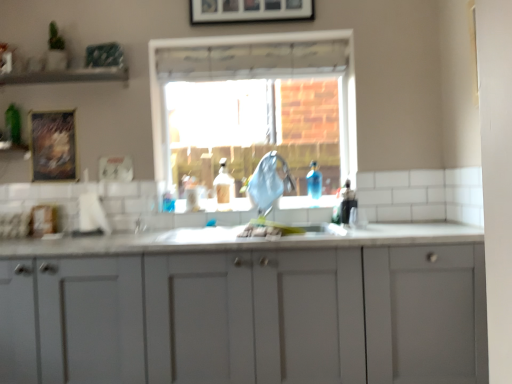
Where is `wooden framed picture at upper center, acting as the 2th picture frame starting from the back`? wooden framed picture at upper center, acting as the 2th picture frame starting from the back is located at coordinates (249, 11).

What is the approximate width of blue fabric at center?

It is 21.92 centimeters.

What are the coordinates of `translucent plastic bottle at center` in the screenshot? It's located at (224, 185).

Find the location of a particular element. This screenshot has width=512, height=384. wooden framed picture at upper center, acting as the 2th picture frame starting from the back is located at coordinates (249, 11).

Which point is more forward, (265, 176) or (51, 112)?

The point (265, 176) is closer to the camera.

Considering the sizes of objects blue fabric at center and wooden textured frame at upper left, which is the second picture frame from right to left, in the image provided, who is taller, blue fabric at center or wooden textured frame at upper left, which is the second picture frame from right to left,?

wooden textured frame at upper left, which is the second picture frame from right to left, is taller.

Is blue fabric at center beside wooden textured frame at upper left, the 2th picture frame when ordered from top to bottom?

No, blue fabric at center is not touching wooden textured frame at upper left, the 2th picture frame when ordered from top to bottom.

Is translucent plastic bottle at center inside or outside of blue fabric at center?

translucent plastic bottle at center is located beyond the bounds of blue fabric at center.

From the image's perspective, would you say translucent plastic bottle at center is positioned over blue fabric at center?

No.

Is translucent plastic bottle at center looking in the opposite direction of blue fabric at center?

No.

Considering the relative positions of translucent plastic bottle at center and blue fabric at center in the image provided, is translucent plastic bottle at center in front of blue fabric at center?

No.

In the scene shown: Would you say clear glass window at center contains translucent plastic bottle at center?

No, translucent plastic bottle at center is not surrounded by clear glass window at center.

Which is behind, clear glass window at center or translucent plastic bottle at center?

Positioned behind is clear glass window at center.

Is clear glass window at center facing towards translucent plastic bottle at center?

Yes, clear glass window at center is oriented towards translucent plastic bottle at center.

Do you think clear glass window at center is within blue fabric at center, or outside of it?

clear glass window at center lies outside blue fabric at center.

From a real-world perspective, between clear glass window at center and blue fabric at center, who is vertically lower?

blue fabric at center, from a real-world perspective.

Based on the photo, from the image's perspective, is clear glass window at center above or below blue fabric at center?

Based on their image positions, clear glass window at center is located above blue fabric at center.

Which is behind, point (50, 168) or point (284, 19)?

Point (50, 168)

Is wooden textured frame at upper left, placed as the first picture frame when sorted from bottom to top, inside the boundaries of wooden framed picture at upper center, acting as the 2th picture frame starting from the back, or outside?

wooden textured frame at upper left, placed as the first picture frame when sorted from bottom to top, is spatially situated outside wooden framed picture at upper center, acting as the 2th picture frame starting from the back.

Is wooden textured frame at upper left, placed as the first picture frame when sorted from bottom to top, further to camera compared to wooden framed picture at upper center, acting as the first picture frame starting from the front?

Yes, wooden textured frame at upper left, placed as the first picture frame when sorted from bottom to top, is further from the camera.

What's the angular difference between wooden textured frame at upper left, the 2th picture frame when ordered from top to bottom, and wooden framed picture at upper center, acting as the first picture frame starting from the front,'s facing directions?

The facing directions of wooden textured frame at upper left, the 2th picture frame when ordered from top to bottom, and wooden framed picture at upper center, acting as the first picture frame starting from the front, are 0.539 degrees apart.

This screenshot has height=384, width=512. Identify the location of bottle behind the white matte cabinet at center. (224, 185).

From a real-world perspective, is translucent plastic bottle at center physically below white matte cabinet at center?

No, from a real-world perspective, translucent plastic bottle at center is not below white matte cabinet at center.

Is translucent plastic bottle at center to the left or to the right of white matte cabinet at center in the image?

Clearly, translucent plastic bottle at center is on the right of white matte cabinet at center in the image.

In terms of height, does translucent plastic bottle at center look taller or shorter compared to white matte cabinet at center?

translucent plastic bottle at center is shorter than white matte cabinet at center.

Is point (226, 204) positioned after point (70, 123)?

That is True.

Is there a large distance between translucent plastic bottle at center and wooden textured frame at upper left, which is the second picture frame from right to left?

translucent plastic bottle at center is actually quite close to wooden textured frame at upper left, which is the second picture frame from right to left.

Considering the relative sizes of translucent plastic bottle at center and wooden textured frame at upper left, the 2th picture frame when ordered from top to bottom, in the image provided, is translucent plastic bottle at center wider than wooden textured frame at upper left, the 2th picture frame when ordered from top to bottom,?

Yes, translucent plastic bottle at center is wider than wooden textured frame at upper left, the 2th picture frame when ordered from top to bottom.

Locate an element on the screen. faucet below the wooden textured frame at upper left, the 2th picture frame when ordered from top to bottom (from the image's perspective) is located at coordinates (268, 182).

This screenshot has height=384, width=512. Identify the location of faucet that is above the translucent plastic bottle at center (from the image's perspective). (268, 182).

Estimate the real-world distances between objects in this image. Which object is further from wooden textured frame at upper left, which is the second picture frame from right to left, wooden framed picture at upper center, marked as the first picture frame in a top-to-bottom arrangement, or clear glass window at center?

The object further to wooden textured frame at upper left, which is the second picture frame from right to left, is wooden framed picture at upper center, marked as the first picture frame in a top-to-bottom arrangement.

When comparing their distances from translucent plastic bottle at center, does wooden framed picture at upper center, acting as the first picture frame starting from the front, or blue fabric at center seem further?

wooden framed picture at upper center, acting as the first picture frame starting from the front, is further to translucent plastic bottle at center.

Which object lies further to the anchor point wooden framed picture at upper center, which is the 2th picture frame in bottom-to-top order, wooden textured frame at upper left, the 2th picture frame viewed from the front, or blue fabric at center?

Among the two, wooden textured frame at upper left, the 2th picture frame viewed from the front, is located further to wooden framed picture at upper center, which is the 2th picture frame in bottom-to-top order.

Based on their spatial positions, is white matte cabinet at center or blue fabric at center further from translucent plastic bottle at center?

Among the two, white matte cabinet at center is located further to translucent plastic bottle at center.

When comparing their distances from clear glass window at center, does translucent plastic bottle at center or white matte cabinet at center seem further?

white matte cabinet at center is positioned further to the anchor clear glass window at center.

When comparing their distances from clear glass window at center, does wooden textured frame at upper left, which is the second picture frame from right to left, or wooden framed picture at upper center, the second picture frame when ordered from left to right, seem further?

wooden textured frame at upper left, which is the second picture frame from right to left, lies further to clear glass window at center than the other object.

Estimate the real-world distances between objects in this image. Which object is further from wooden textured frame at upper left, the 2th picture frame viewed from the front, wooden framed picture at upper center, which is the 2th picture frame in bottom-to-top order, or translucent plastic bottle at center?

Among the two, wooden framed picture at upper center, which is the 2th picture frame in bottom-to-top order, is located further to wooden textured frame at upper left, the 2th picture frame viewed from the front.

When comparing their distances from wooden textured frame at upper left, which is the second picture frame from right to left, does clear glass window at center or translucent plastic bottle at center seem further?

translucent plastic bottle at center is further to wooden textured frame at upper left, which is the second picture frame from right to left.

Where is `bottle between clear glass window at center and white matte cabinet at center in the up-down direction`? This screenshot has width=512, height=384. bottle between clear glass window at center and white matte cabinet at center in the up-down direction is located at coordinates (224, 185).

Where is `faucet that lies between wooden framed picture at upper center, marked as the first picture frame in a top-to-bottom arrangement, and translucent plastic bottle at center from top to bottom`? The height and width of the screenshot is (384, 512). faucet that lies between wooden framed picture at upper center, marked as the first picture frame in a top-to-bottom arrangement, and translucent plastic bottle at center from top to bottom is located at coordinates (268, 182).

In order to click on window between wooden framed picture at upper center, positioned as the first picture frame in right-to-left order, and white matte cabinet at center from top to bottom in this screenshot , I will do `click(261, 44)`.

The image size is (512, 384). Identify the location of picture frame located between wooden textured frame at upper left, which is the second picture frame from right to left, and clear glass window at center in the left-right direction. (249, 11).